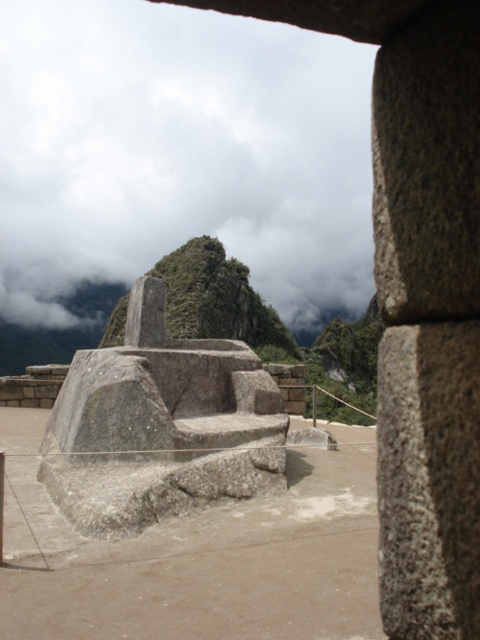
Question: Can you confirm if white fluffy cloud at upper center is positioned to the right of gray stone seat at center?

Choices:
 (A) yes
 (B) no

Answer: (B)

Question: Does white fluffy cloud at upper center appear under gray stone seat at center?

Choices:
 (A) yes
 (B) no

Answer: (B)

Question: Which point is farther to the camera?

Choices:
 (A) white fluffy cloud at upper center
 (B) gray stone seat at center

Answer: (A)

Question: Is white fluffy cloud at upper center closer to camera compared to gray stone seat at center?

Choices:
 (A) no
 (B) yes

Answer: (A)

Question: Which object is closer to the camera taking this photo?

Choices:
 (A) white fluffy cloud at upper center
 (B) gray stone seat at center

Answer: (B)